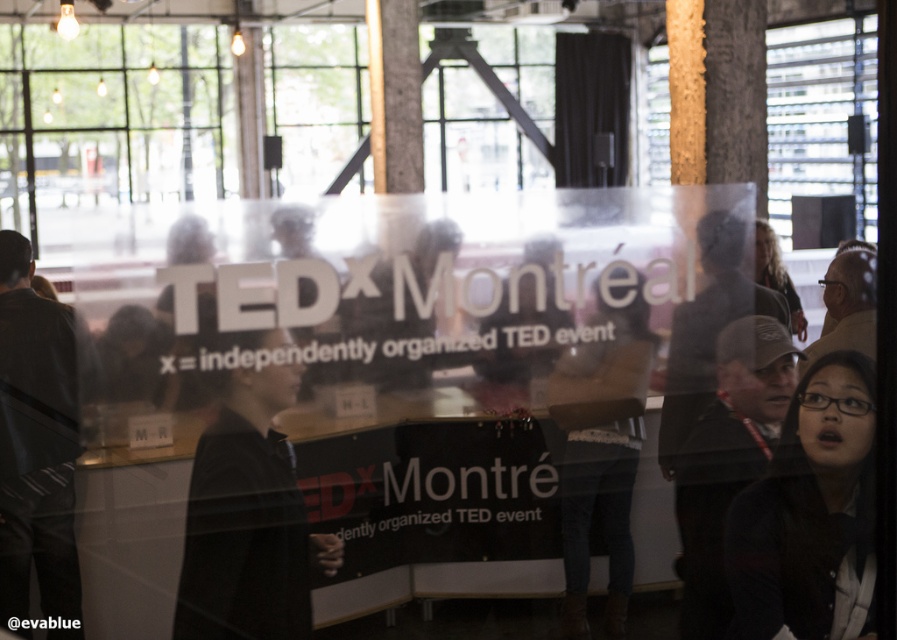
Question: Is the position of denim pants at center less distant than that of dark gray cap at center?

Choices:
 (A) yes
 (B) no

Answer: (A)

Question: Is denim pants at center to the left of dark gray cap at center from the viewer's perspective?

Choices:
 (A) no
 (B) yes

Answer: (B)

Question: Is black matte jacket at center below denim pants at center?

Choices:
 (A) no
 (B) yes

Answer: (A)

Question: Among these objects, which one is nearest to the camera?

Choices:
 (A) black matte jacket at lower right
 (B) dark gray cap at center

Answer: (B)

Question: Among these objects, which one is nearest to the camera?

Choices:
 (A) black matte jacket at lower right
 (B) black matte jacket at center
 (C) denim pants at center
 (D) dark gray jacket at left

Answer: (B)

Question: Which of the following is the farthest from the observer?

Choices:
 (A) wooden at upper right
 (B) black matte jacket at lower right

Answer: (B)